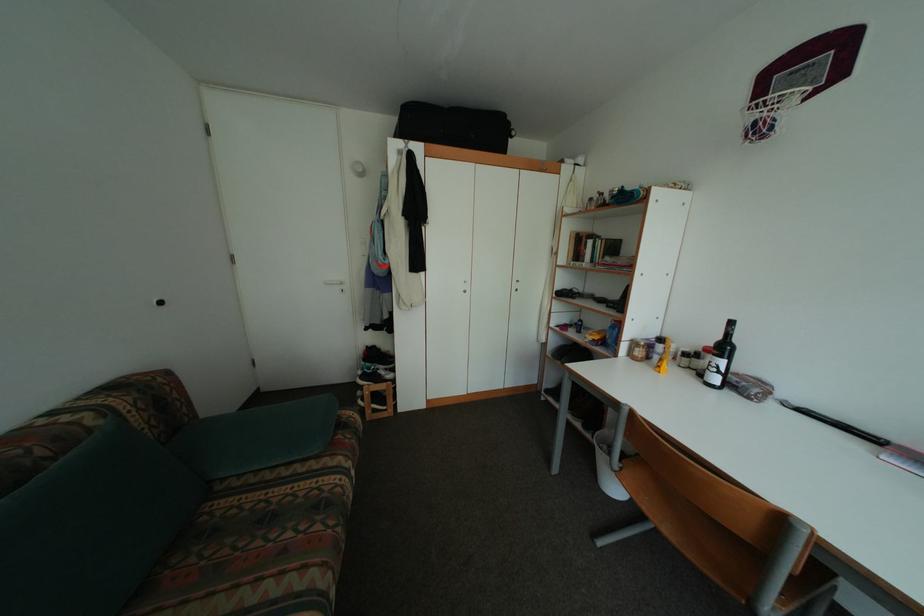
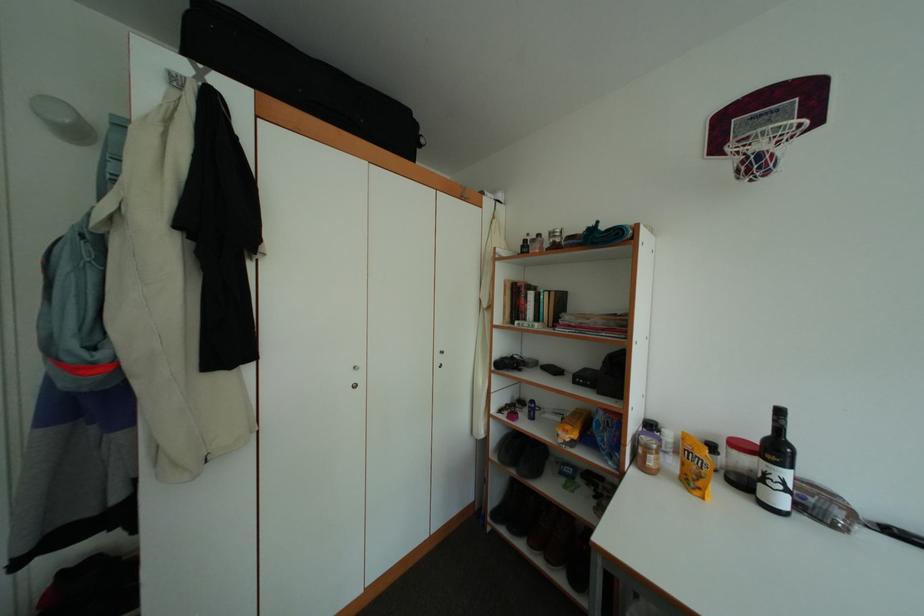
Question: The first image is from the beginning of the video and the second image is from the end. How did the camera likely rotate when shooting the video?

Choices:
 (A) Left
 (B) Right
 (C) Up
 (D) Down

Answer: (B)